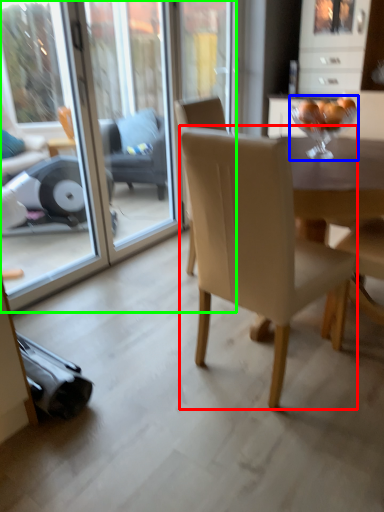
Question: Which is farther away from chair (highlighted by a red box)? wine glass (highlighted by a blue box) or screen door (highlighted by a green box)?

Choices:
 (A) wine glass
 (B) screen door

Answer: (B)